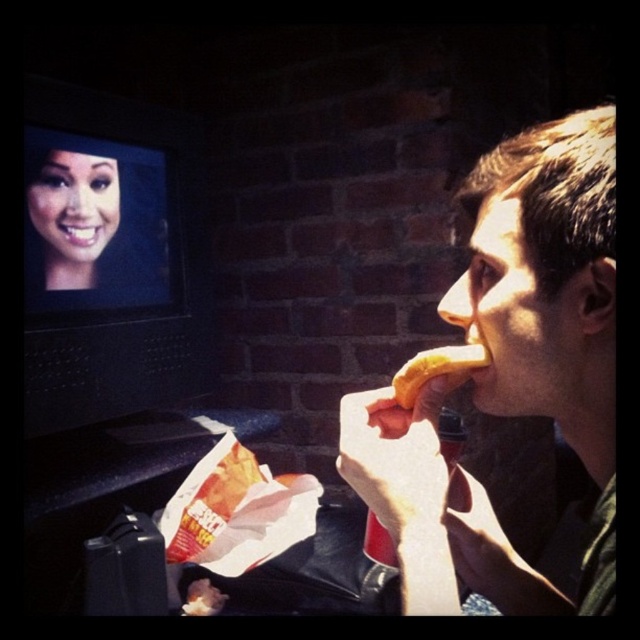
You are a photographer trying to capture a closeup shot of the matte yellow hot dog at right and the smooth skin face at upper left. Since the camera can only focus on one subject at a time, which object should you choose to ensure the larger subject is in focus?

The matte yellow hot dog at right is bigger than the smooth skin face at upper left, so you should focus on the matte yellow hot dog at right to ensure the larger subject is in focus.

In the scene shown: You are a food delivery person who needs to place a matte yellow hot dog at right on a table that is 30 centimeters away from you. Can you place it directly in front of you without moving your position?

The matte yellow hot dog at right and viewer are 34.90 centimeters apart from each other. Since the table is only 30 centimeters away, you need to move closer or adjust the placement to ensure the hot dog reaches the desired spot.

You are a photographer adjusting your camera to focus on two points in the scene. The first point is at coordinate point (x=595, y=147) and the second is at point (x=49, y=180). Which point should you focus on first if you want to capture the closest object in the scene?

You should focus on point (x=595, y=147) first because it is closer to the camera than point (x=49, y=180).